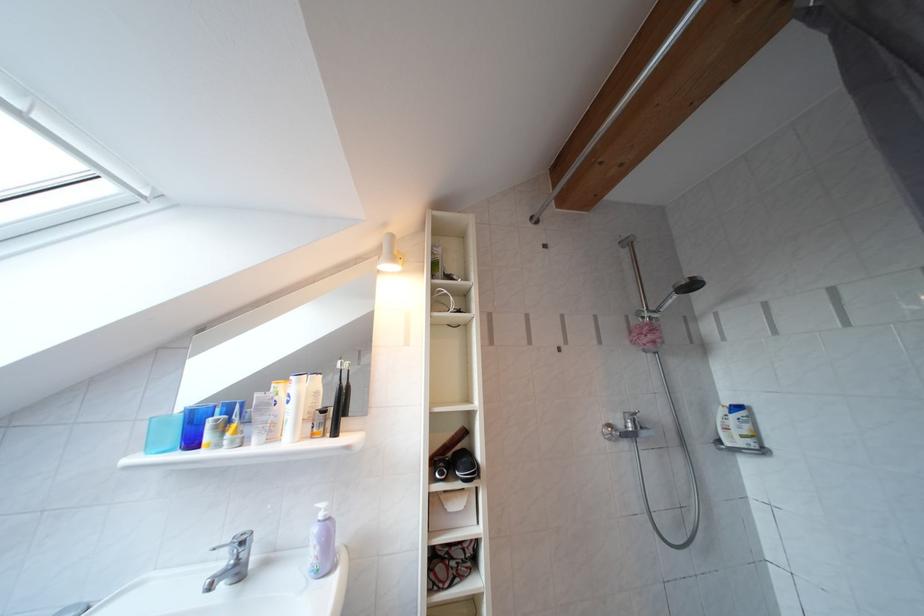
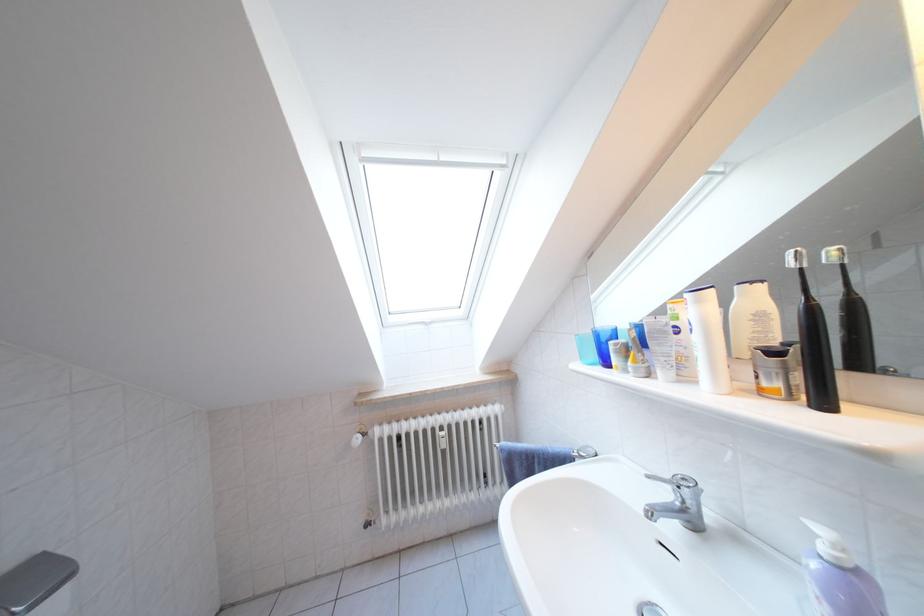
Locate, in the second image, the point that corresponds to point 233,565 in the first image.

(675, 500)